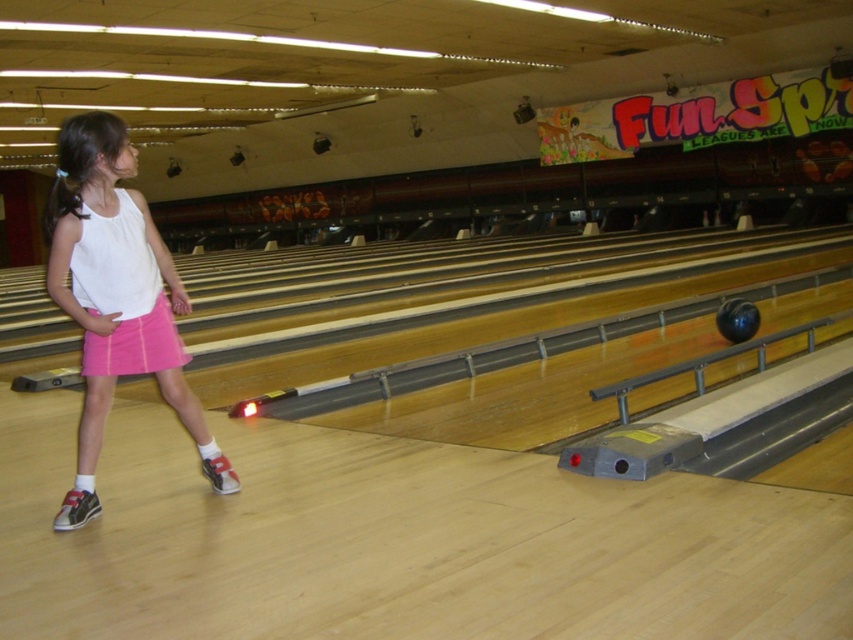
Is white matte tank top at center positioned at the back of pink cotton shorts at lower left?

No, it is in front of pink cotton shorts at lower left.

Is white matte tank top at center wider than pink cotton shorts at lower left?

Yes.

Who is more forward, (167, 364) or (119, 342)?

Point (119, 342)

The image size is (853, 640). In order to click on white matte tank top at center in this screenshot , I will do `click(115, 298)`.